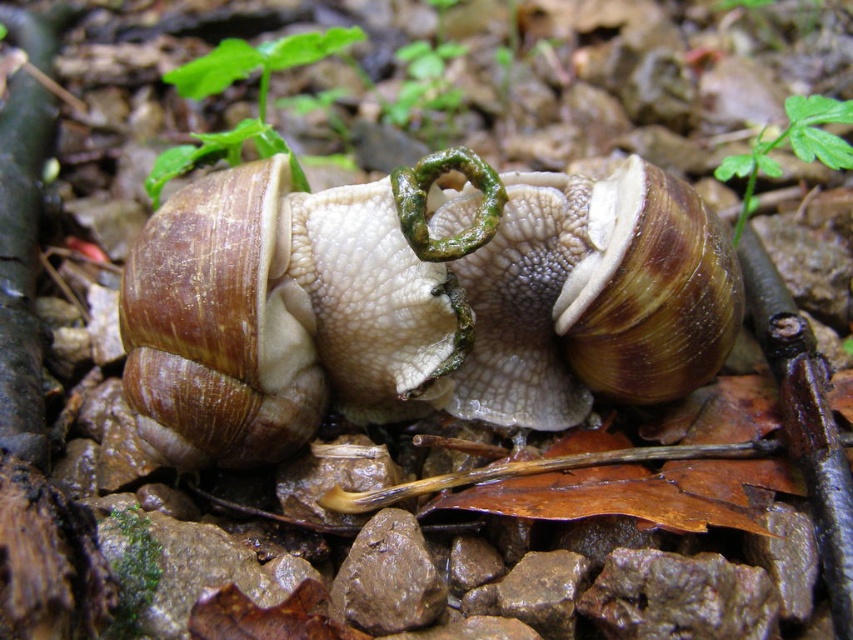
You are a biologist observing two snails in a forest. You notice their shells labeled as matte brown shell at center and brown textured shell at center. Based on their positions, which snail is closer to you?

The matte brown shell at center is closer to you because it is positioned in front of the brown textured shell at center.